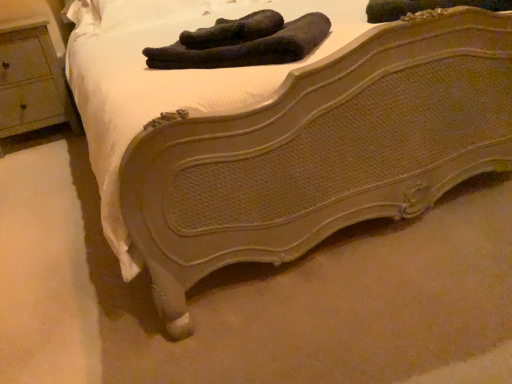
This screenshot has width=512, height=384. What do you see at coordinates (243, 42) in the screenshot?
I see `black fuzzy socks at center, the first footwear when ordered from right to left` at bounding box center [243, 42].

Measure the distance between wooden nightstand at left and camera.

wooden nightstand at left is 2.15 meters from camera.

Describe the element at coordinates (233, 31) in the screenshot. The image size is (512, 384). I see `dark green fabric socks at upper center, the 1th footwear from the left` at that location.

Where is `black fuzzy socks at center, placed as the second footwear when sorted from left to right`? The height and width of the screenshot is (384, 512). black fuzzy socks at center, placed as the second footwear when sorted from left to right is located at coordinates (243, 42).

In the image, is dark green fabric socks at upper center, which is the second footwear from right to left, on the left side or the right side of wooden nightstand at left?

dark green fabric socks at upper center, which is the second footwear from right to left, is positioned on wooden nightstand at left's right side.

Where is `nightstand behind the dark green fabric socks at upper center, which is the second footwear from right to left`? nightstand behind the dark green fabric socks at upper center, which is the second footwear from right to left is located at coordinates (32, 69).

Is dark green fabric socks at upper center, which is the second footwear from right to left, far from wooden nightstand at left?

Absolutely, dark green fabric socks at upper center, which is the second footwear from right to left, is distant from wooden nightstand at left.

How many degrees apart are the facing directions of dark green fabric socks at upper center, which is the second footwear from right to left, and wooden nightstand at left?

They differ by 46.1 degrees in their facing directions.

Is black fuzzy socks at center, the first footwear when ordered from right to left, at the back of dark green fabric socks at upper center, which is the second footwear from right to left?

No, black fuzzy socks at center, the first footwear when ordered from right to left, is not at the back of dark green fabric socks at upper center, which is the second footwear from right to left.

There is a black fuzzy socks at center, placed as the second footwear when sorted from left to right. Where is `footwear above it (from a real-world perspective)`? This screenshot has height=384, width=512. footwear above it (from a real-world perspective) is located at coordinates (233, 31).

Could you measure the distance between dark green fabric socks at upper center, the 1th footwear from the left, and black fuzzy socks at center, placed as the second footwear when sorted from left to right?

A distance of 1.29 inches exists between dark green fabric socks at upper center, the 1th footwear from the left, and black fuzzy socks at center, placed as the second footwear when sorted from left to right.

Between dark green fabric socks at upper center, the 1th footwear from the left, and black fuzzy socks at center, placed as the second footwear when sorted from left to right, which one has larger size?

black fuzzy socks at center, placed as the second footwear when sorted from left to right, is bigger.

Between wooden nightstand at left and black fuzzy socks at center, the first footwear when ordered from right to left, which one has smaller size?

Smaller between the two is black fuzzy socks at center, the first footwear when ordered from right to left.

Does point (37, 78) come behind point (227, 66)?

Yes, point (37, 78) is behind point (227, 66).

In the scene shown: Considering the relative positions of wooden nightstand at left and black fuzzy socks at center, the first footwear when ordered from right to left, in the image provided, is wooden nightstand at left behind black fuzzy socks at center, the first footwear when ordered from right to left,?

Yes, it is behind black fuzzy socks at center, the first footwear when ordered from right to left.

Between wooden nightstand at left and black fuzzy socks at center, the first footwear when ordered from right to left, which one appears on the right side from the viewer's perspective?

black fuzzy socks at center, the first footwear when ordered from right to left, is more to the right.

How far apart are black fuzzy socks at center, the first footwear when ordered from right to left, and dark green fabric socks at upper center, the 1th footwear from the left?

A distance of 1.29 inches exists between black fuzzy socks at center, the first footwear when ordered from right to left, and dark green fabric socks at upper center, the 1th footwear from the left.

From the image's perspective, between black fuzzy socks at center, placed as the second footwear when sorted from left to right, and dark green fabric socks at upper center, which is the second footwear from right to left, who is located below?

black fuzzy socks at center, placed as the second footwear when sorted from left to right.

Does point (265, 38) lie in front of point (238, 32)?

Yes, point (265, 38) is closer to viewer.

In the image, is black fuzzy socks at center, placed as the second footwear when sorted from left to right, on the left side or the right side of dark green fabric socks at upper center, the 1th footwear from the left?

Based on their positions, black fuzzy socks at center, placed as the second footwear when sorted from left to right, is located to the right of dark green fabric socks at upper center, the 1th footwear from the left.

Is wooden nightstand at left outside of dark green fabric socks at upper center, the 1th footwear from the left?

Yes, wooden nightstand at left is not within dark green fabric socks at upper center, the 1th footwear from the left.

Is wooden nightstand at left oriented away from dark green fabric socks at upper center, which is the second footwear from right to left?

No, dark green fabric socks at upper center, which is the second footwear from right to left, is not at the back of wooden nightstand at left.

Does point (1, 40) come in front of point (234, 31)?

No, (1, 40) is further to viewer.

Consider the image. Would you say wooden nightstand at left is part of black fuzzy socks at center, placed as the second footwear when sorted from left to right,'s contents?

No, wooden nightstand at left is not surrounded by black fuzzy socks at center, placed as the second footwear when sorted from left to right.

Considering the relative sizes of black fuzzy socks at center, placed as the second footwear when sorted from left to right, and wooden nightstand at left in the image provided, is black fuzzy socks at center, placed as the second footwear when sorted from left to right, bigger than wooden nightstand at left?

No.

Considering the sizes of black fuzzy socks at center, placed as the second footwear when sorted from left to right, and wooden nightstand at left in the image, is black fuzzy socks at center, placed as the second footwear when sorted from left to right, taller or shorter than wooden nightstand at left?

In the image, black fuzzy socks at center, placed as the second footwear when sorted from left to right, appears to be shorter than wooden nightstand at left.

From the wooden nightstand at left, count 1st footwears forward and point to it. Please provide its 2D coordinates.

[(233, 31)]

This screenshot has height=384, width=512. What are the coordinates of `footwear that is behind the black fuzzy socks at center, the first footwear when ordered from right to left` in the screenshot? It's located at (233, 31).

Which object lies nearer to the anchor point wooden nightstand at left, dark green fabric socks at upper center, the 1th footwear from the left, or black fuzzy socks at center, placed as the second footwear when sorted from left to right?

dark green fabric socks at upper center, the 1th footwear from the left, lies closer to wooden nightstand at left than the other object.

Which object lies further to the anchor point dark green fabric socks at upper center, which is the second footwear from right to left, wooden nightstand at left or black fuzzy socks at center, placed as the second footwear when sorted from left to right?

wooden nightstand at left.

Based on their spatial positions, is wooden nightstand at left or dark green fabric socks at upper center, which is the second footwear from right to left, closer to black fuzzy socks at center, the first footwear when ordered from right to left?

dark green fabric socks at upper center, which is the second footwear from right to left.

Considering their positions, is black fuzzy socks at center, the first footwear when ordered from right to left, positioned closer to wooden nightstand at left than dark green fabric socks at upper center, which is the second footwear from right to left?

dark green fabric socks at upper center, which is the second footwear from right to left, is closer to wooden nightstand at left.

When comparing their distances from dark green fabric socks at upper center, the 1th footwear from the left, does black fuzzy socks at center, placed as the second footwear when sorted from left to right, or wooden nightstand at left seem further?

wooden nightstand at left is positioned further to the anchor dark green fabric socks at upper center, the 1th footwear from the left.

Looking at the image, which one is located further to black fuzzy socks at center, the first footwear when ordered from right to left, dark green fabric socks at upper center, the 1th footwear from the left, or wooden nightstand at left?

wooden nightstand at left.

The width and height of the screenshot is (512, 384). Find the location of `footwear located between wooden nightstand at left and black fuzzy socks at center, the first footwear when ordered from right to left, in the left-right direction`. footwear located between wooden nightstand at left and black fuzzy socks at center, the first footwear when ordered from right to left, in the left-right direction is located at coordinates (233, 31).